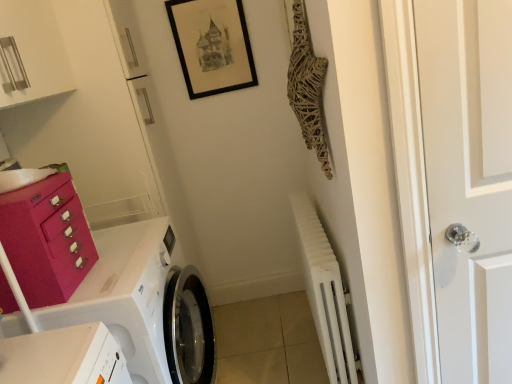
The width and height of the screenshot is (512, 384). Identify the location of vacant region above white matte radiator at lower right (from a real-world perspective). (307, 225).